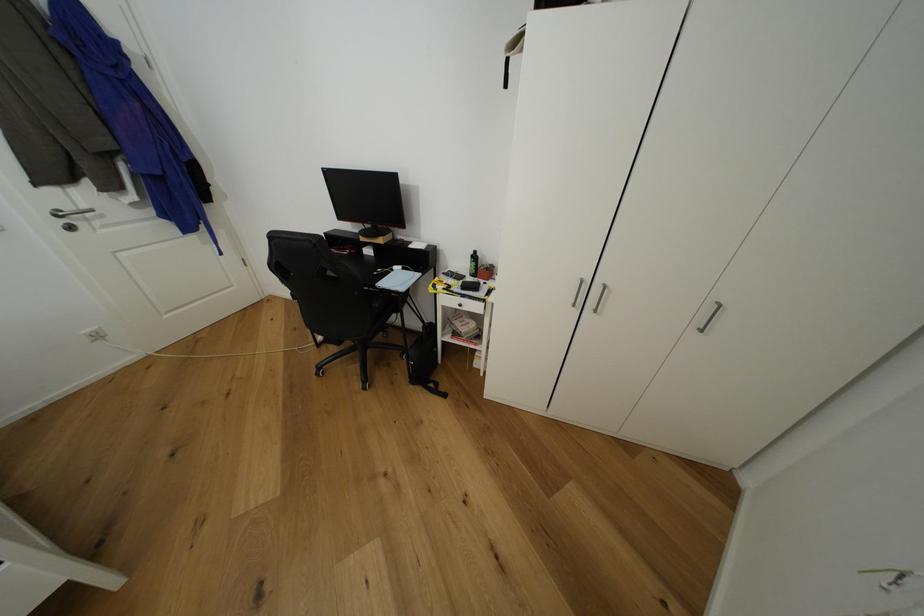
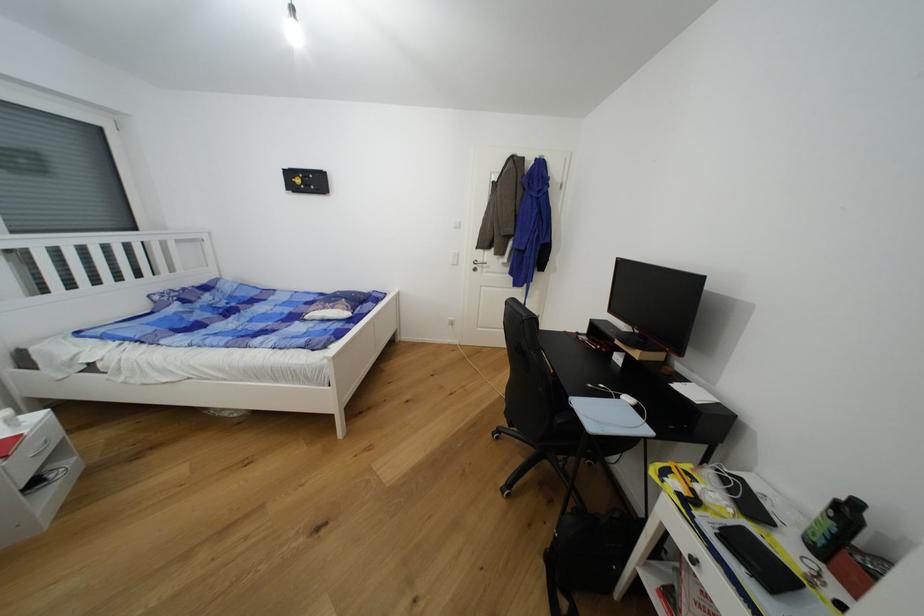
Find the pixel in the second image that matches (x=398, y=272) in the first image.

(623, 399)